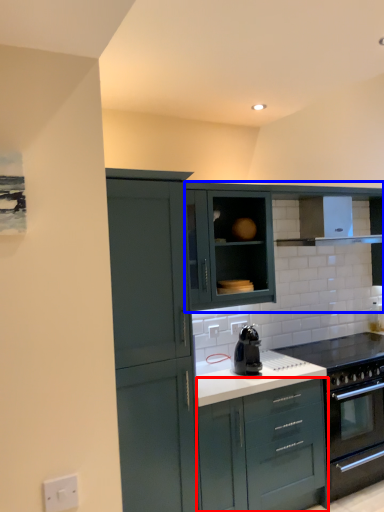
Question: Which point is closer to the camera, cabinetry (highlighted by a red box) or cabinetry (highlighted by a blue box)?

Choices:
 (A) cabinetry
 (B) cabinetry

Answer: (A)